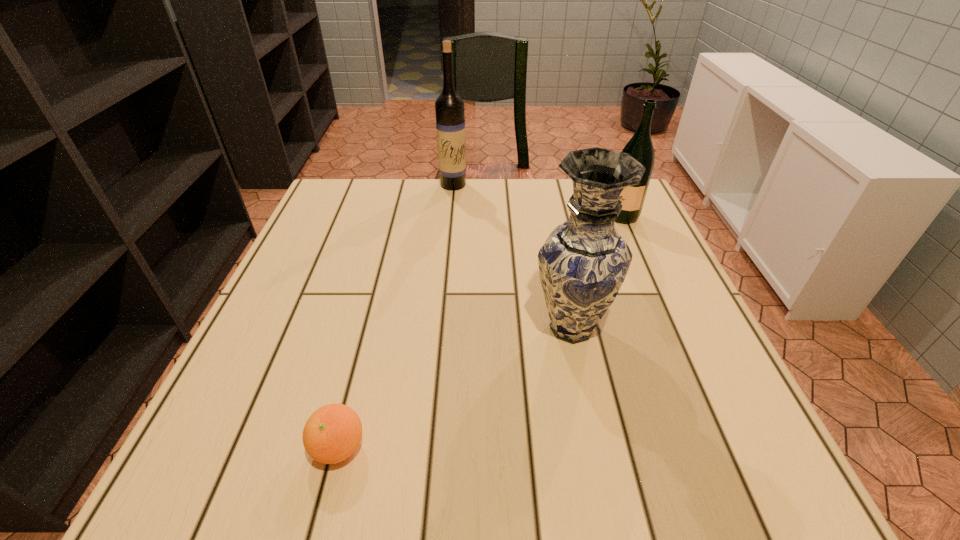
I want to click on the farther wine bottle, so click(x=449, y=107).

At what (x,y) coordinates should I click in order to perform the action: click on the farthest object. Please return your answer as a coordinate pair (x, y). The image size is (960, 540). Looking at the image, I should click on (449, 107).

I want to click on the second object from right to left, so click(583, 263).

You are a GUI agent. You are given a task and a screenshot of the screen. Output one action in this format:
    pyautogui.click(x=<x>, y=<y>)
    Task: Click on the third farthest object
    This screenshot has width=960, height=540.
    Given the screenshot: What is the action you would take?
    pyautogui.click(x=583, y=263)

The image size is (960, 540). Find the location of `the shorter wine bottle`. the shorter wine bottle is located at coordinates (640, 147).

Locate an element on the screen. the second shortest object is located at coordinates (640, 147).

Locate an element on the screen. The height and width of the screenshot is (540, 960). the leftmost object is located at coordinates (332, 433).

Where is `the shortest object`? This screenshot has height=540, width=960. the shortest object is located at coordinates (332, 433).

This screenshot has height=540, width=960. I want to click on vacant area situated on the label of the farther wine bottle, so click(450, 218).

The image size is (960, 540). I want to click on free space located 0.200m on the front of the vase, so click(x=601, y=468).